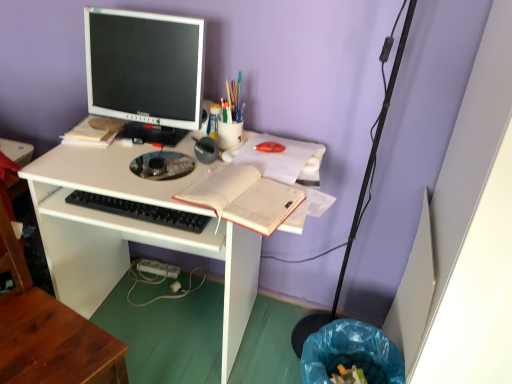
Locate an element on the screen. black plastic keyboard at center is located at coordinates (140, 211).

Where is `white matte desk at center`? The height and width of the screenshot is (384, 512). white matte desk at center is located at coordinates (131, 233).

The image size is (512, 384). Find the location of `translucent plastic cup at upper center, marked as the first stationery in a back-to-front arrangement`. translucent plastic cup at upper center, marked as the first stationery in a back-to-front arrangement is located at coordinates [x=213, y=121].

Based on the photo, is metallic gray pen at center, marked as the third stationery in a back-to-front arrangement, at the right side of satin black monitor at upper left?

Indeed, metallic gray pen at center, marked as the third stationery in a back-to-front arrangement, is positioned on the right side of satin black monitor at upper left.

Considering their positions, is metallic gray pen at center, the 1th stationery from the front, located in front of or behind satin black monitor at upper left?

Clearly, metallic gray pen at center, the 1th stationery from the front, is behind satin black monitor at upper left.

From the image's perspective, is metallic gray pen at center, marked as the third stationery in a back-to-front arrangement, located above satin black monitor at upper left?

No, from the image's perspective, metallic gray pen at center, marked as the third stationery in a back-to-front arrangement, is not on top of satin black monitor at upper left.

Is metallic gray pen at center, the 1th stationery from the front, inside or outside of satin black monitor at upper left?

metallic gray pen at center, the 1th stationery from the front, is located beyond the bounds of satin black monitor at upper left.

Is satin black monitor at upper left inside the boundaries of translucent plastic cup at upper center, marked as the first stationery in a back-to-front arrangement, or outside?

satin black monitor at upper left is not enclosed by translucent plastic cup at upper center, marked as the first stationery in a back-to-front arrangement.

Is point (199, 103) closer or farther from the camera than point (209, 133)?

Point (199, 103) appears to be closer to the viewer than point (209, 133).

Does satin black monitor at upper left have a lesser width compared to translucent plastic cup at upper center, marked as the first stationery in a back-to-front arrangement?

In fact, satin black monitor at upper left might be wider than translucent plastic cup at upper center, marked as the first stationery in a back-to-front arrangement.

From the image's perspective, which object appears higher, satin black monitor at upper left or translucent plastic cup at upper center, marked as the first stationery in a back-to-front arrangement?

satin black monitor at upper left.

From the picture: From the image's perspective, who appears lower, matte plastic cup at upper center, acting as the 2th stationery starting from the back, or white plastic power plugs and sockets at lower center?

From the image's view, white plastic power plugs and sockets at lower center is below.

Considering the sizes of objects matte plastic cup at upper center, acting as the 2th stationery starting from the back, and white plastic power plugs and sockets at lower center in the image provided, who is bigger, matte plastic cup at upper center, acting as the 2th stationery starting from the back, or white plastic power plugs and sockets at lower center?

With larger size is matte plastic cup at upper center, acting as the 2th stationery starting from the back.

Which of these two, matte plastic cup at upper center, acting as the 2th stationery starting from the back, or white plastic power plugs and sockets at lower center, is wider?

matte plastic cup at upper center, acting as the 2th stationery starting from the back.

Considering the positions of objects matte plastic cup at upper center, acting as the 2th stationery starting from the back, and white plastic power plugs and sockets at lower center in the image provided, who is more to the right, matte plastic cup at upper center, acting as the 2th stationery starting from the back, or white plastic power plugs and sockets at lower center?

matte plastic cup at upper center, acting as the 2th stationery starting from the back, is more to the right.

Between wooden at left and black plastic keyboard at center, which one is positioned in front?

Positioned in front is wooden at left.

How different are the orientations of wooden at left and black plastic keyboard at center in degrees?

66.6 degrees separate the facing orientations of wooden at left and black plastic keyboard at center.

Does point (48, 335) lie behind point (187, 214)?

No, it is in front of (187, 214).

Image resolution: width=512 pixels, height=384 pixels. Find the location of `computer keyboard above the wooden at left (from the image's perspective)`. computer keyboard above the wooden at left (from the image's perspective) is located at coordinates (140, 211).

Which object is closer to the camera, black plastic keyboard at center or matte plastic cup at upper center, which appears as the second stationery when viewed from the front?

black plastic keyboard at center.

Can you tell me how much black plastic keyboard at center and matte plastic cup at upper center, acting as the 2th stationery starting from the back, differ in facing direction?

The angle between the facing direction of black plastic keyboard at center and the facing direction of matte plastic cup at upper center, acting as the 2th stationery starting from the back, is 2.9 degrees.

Considering the positions of objects black plastic keyboard at center and matte plastic cup at upper center, acting as the 2th stationery starting from the back, in the image provided, who is more to the right, black plastic keyboard at center or matte plastic cup at upper center, acting as the 2th stationery starting from the back,?

Positioned to the right is matte plastic cup at upper center, acting as the 2th stationery starting from the back.

Looking at their sizes, would you say black plastic keyboard at center is wider or thinner than matte plastic cup at upper center, acting as the 2th stationery starting from the back?

Considering their sizes, black plastic keyboard at center looks broader than matte plastic cup at upper center, acting as the 2th stationery starting from the back.

From the image's perspective, is white plastic power plugs and sockets at lower center positioned above or below matte plastic cup at upper center, acting as the 2th stationery starting from the back?

Clearly, from the image's perspective, white plastic power plugs and sockets at lower center is below matte plastic cup at upper center, acting as the 2th stationery starting from the back.

Is matte plastic cup at upper center, acting as the 2th stationery starting from the back, at the back of white plastic power plugs and sockets at lower center?

No, matte plastic cup at upper center, acting as the 2th stationery starting from the back, is not at the back of white plastic power plugs and sockets at lower center.

Is white plastic power plugs and sockets at lower center next to matte plastic cup at upper center, acting as the 2th stationery starting from the back, and touching it?

white plastic power plugs and sockets at lower center and matte plastic cup at upper center, acting as the 2th stationery starting from the back, are clearly separated.

Is matte plastic cup at upper center, acting as the 2th stationery starting from the back, a part of white plastic power plugs and sockets at lower center?

That's incorrect, matte plastic cup at upper center, acting as the 2th stationery starting from the back, is not inside white plastic power plugs and sockets at lower center.

Who is taller, black plastic keyboard at center or white plastic power plugs and sockets at lower center?

Standing taller between the two is white plastic power plugs and sockets at lower center.

From the image's perspective, between black plastic keyboard at center and white plastic power plugs and sockets at lower center, who is located below?

From the image's view, white plastic power plugs and sockets at lower center is below.

Is black plastic keyboard at center outside of white plastic power plugs and sockets at lower center?

Absolutely, black plastic keyboard at center is external to white plastic power plugs and sockets at lower center.

Which object is further away from the camera, black plastic keyboard at center or white plastic power plugs and sockets at lower center?

white plastic power plugs and sockets at lower center is behind.

What are the coordinates of `the 1st stationery to the right of the satin black monitor at upper left, counting from the anchor's position` in the screenshot? It's located at (206, 150).

Find the location of a particular element. The image size is (512, 384). computer monitor located above the translucent plastic cup at upper center, marked as the first stationery in a back-to-front arrangement (from a real-world perspective) is located at coordinates (145, 67).

Looking at the image, which one is located closer to white paper notebook at center, matte plastic cup at upper center, which appears as the second stationery when viewed from the front, or white matte desk at center?

white matte desk at center lies closer to white paper notebook at center than the other object.

Estimate the real-world distances between objects in this image. Which object is closer to matte plastic cup at upper center, acting as the 2th stationery starting from the back, wooden at left or white paper notebook at center?

white paper notebook at center is closer to matte plastic cup at upper center, acting as the 2th stationery starting from the back.

Considering their positions, is white plastic power plugs and sockets at lower center positioned closer to metallic gray pen at center, the 1th stationery from the front, than white paper notebook at center?

Among the two, white paper notebook at center is located nearer to metallic gray pen at center, the 1th stationery from the front.

Estimate the real-world distances between objects in this image. Which object is closer to wooden at left, translucent plastic cup at upper center, marked as the first stationery in a back-to-front arrangement, or matte plastic cup at upper center, which appears as the second stationery when viewed from the front?

translucent plastic cup at upper center, marked as the first stationery in a back-to-front arrangement, is closer to wooden at left.

Estimate the real-world distances between objects in this image. Which object is closer to white matte desk at center, black plastic keyboard at center or white plastic power plugs and sockets at lower center?

The object closer to white matte desk at center is black plastic keyboard at center.

Based on their spatial positions, is matte plastic cup at upper center, which appears as the second stationery when viewed from the front, or satin black monitor at upper left closer to blue plastic trash can at lower right?

Based on the image, matte plastic cup at upper center, which appears as the second stationery when viewed from the front, appears to be nearer to blue plastic trash can at lower right.

Considering their positions, is wooden at left positioned closer to blue plastic trash can at lower right than matte plastic cup at upper center, which appears as the second stationery when viewed from the front?

wooden at left is positioned closer to the anchor blue plastic trash can at lower right.

Looking at the image, which one is located closer to wooden at left, translucent plastic cup at upper center, marked as the first stationery in a back-to-front arrangement, or blue plastic trash can at lower right?

blue plastic trash can at lower right.

In order to click on power plugs and sockets between metallic gray pen at center, marked as the third stationery in a back-to-front arrangement, and blue plastic trash can at lower right from top to bottom in this screenshot , I will do `click(175, 287)`.

The height and width of the screenshot is (384, 512). I want to click on computer keyboard between wooden at left and metallic gray pen at center, marked as the third stationery in a back-to-front arrangement, in the front-back direction, so click(x=140, y=211).

Where is `chair between matte plastic cup at upper center, acting as the 2th stationery starting from the back, and blue plastic trash can at lower right from top to bottom`? chair between matte plastic cup at upper center, acting as the 2th stationery starting from the back, and blue plastic trash can at lower right from top to bottom is located at coordinates (49, 332).

Identify the location of desk between wooden at left and blue plastic trash can at lower right in the horizontal direction. (131, 233).